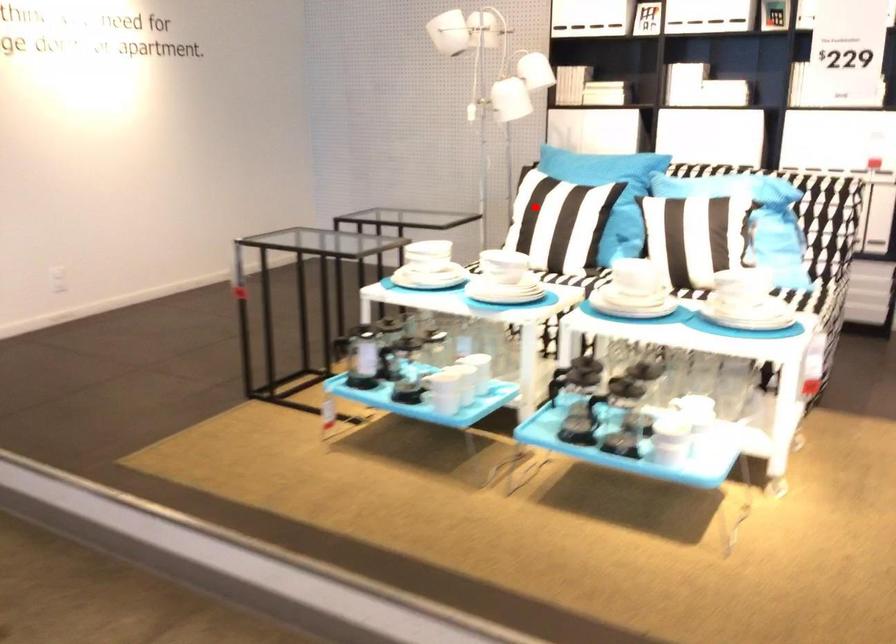
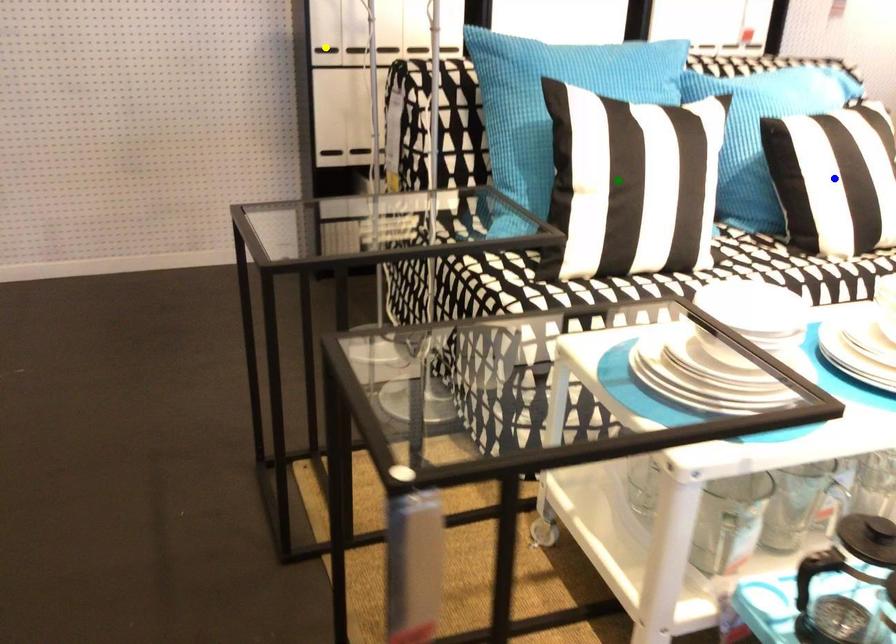
Question: I am providing you with two images of the same scene from different viewpoints. A red point is marked on the first image. You are given multiple points on the second image. Which mark in image 2 goes with the point in image 1?

Choices:
 (A) yellow point
 (B) blue point
 (C) green point

Answer: (C)